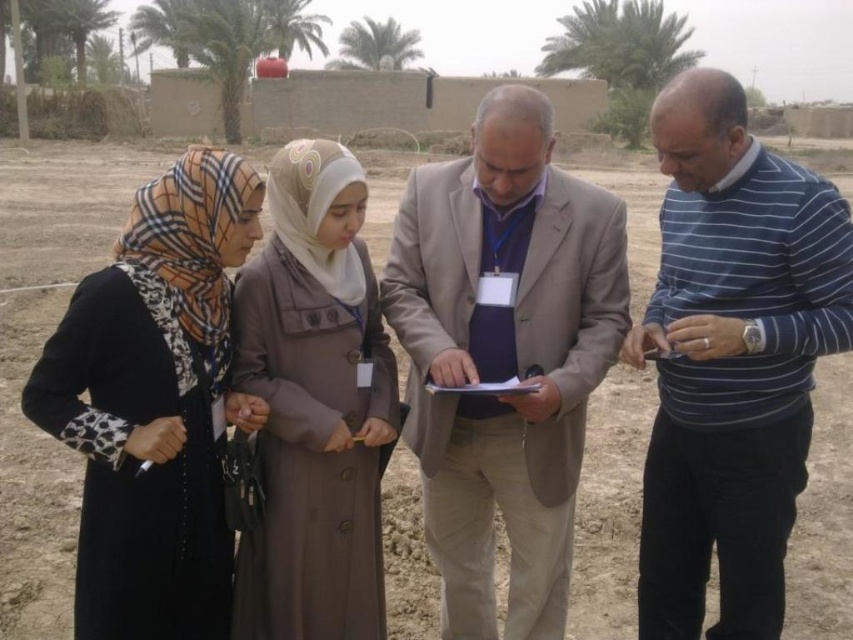
Identify the location of beige fabric suit at center. The image size is (853, 640). (503, 356).

Between beige fabric suit at center and blue striped sweater at center, which one has more height?

blue striped sweater at center

Who is more forward, (534, 147) or (666, 472)?

Point (534, 147) is in front.

You are a GUI agent. You are given a task and a screenshot of the screen. Output one action in this format:
    pyautogui.click(x=<x>, y=<y>)
    Task: Click on the beige fabric suit at center
    
    Given the screenshot: What is the action you would take?
    pyautogui.click(x=503, y=356)

Which of these two, blue striped sweater at center or black fabric hijab at left, stands shorter?

black fabric hijab at left

Does point (668, 512) come closer to viewer compared to point (74, 326)?

That is False.

The height and width of the screenshot is (640, 853). In order to click on blue striped sweater at center in this screenshot , I will do `click(730, 358)`.

Describe the element at coordinates (503, 356) in the screenshot. Image resolution: width=853 pixels, height=640 pixels. I see `beige fabric suit at center` at that location.

In the scene shown: How much distance is there between beige fabric suit at center and black fabric hijab at left?

31.50 inches

The height and width of the screenshot is (640, 853). Identify the location of beige fabric suit at center. (503, 356).

At what (x,y) coordinates should I click in order to perform the action: click on beige fabric suit at center. Please return your answer as a coordinate pair (x, y). Looking at the image, I should click on point(503,356).